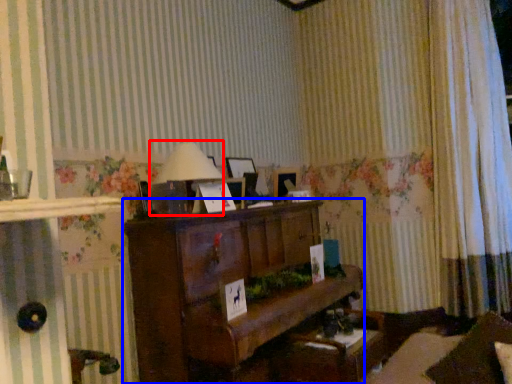
Question: Which object appears closest to the camera in this image, table lamp (highlighted by a red box) or furniture (highlighted by a blue box)?

Choices:
 (A) table lamp
 (B) furniture

Answer: (B)